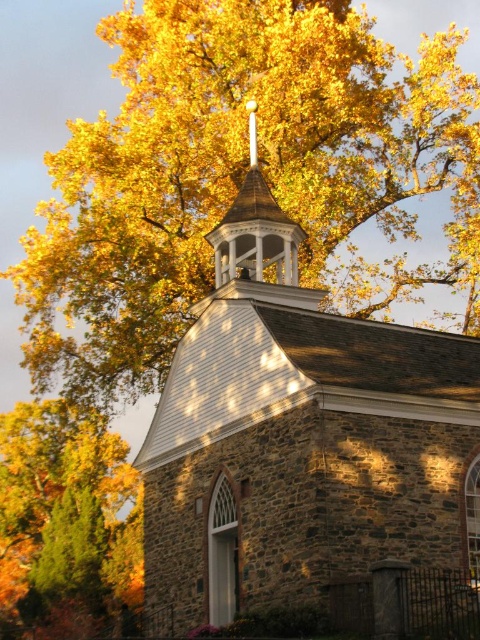
Question: Which point is closer to the camera taking this photo?

Choices:
 (A) (362, 451)
 (B) (434, 42)

Answer: (A)

Question: Which object appears farthest from the camera in this image?

Choices:
 (A) golden leafy tree at upper left
 (B) golden leafy tree at upper center
 (C) stone church at center

Answer: (B)

Question: Is golden leafy tree at upper center thinner than stone church at center?

Choices:
 (A) no
 (B) yes

Answer: (A)

Question: Considering the real-world distances, which object is farthest from the golden leafy tree at upper left?

Choices:
 (A) stone church at center
 (B) golden leafy tree at upper center

Answer: (A)

Question: Does stone church at center come in front of golden leafy tree at upper left?

Choices:
 (A) yes
 (B) no

Answer: (A)

Question: Does golden leafy tree at upper left appear under white wood spire at center?

Choices:
 (A) no
 (B) yes

Answer: (B)